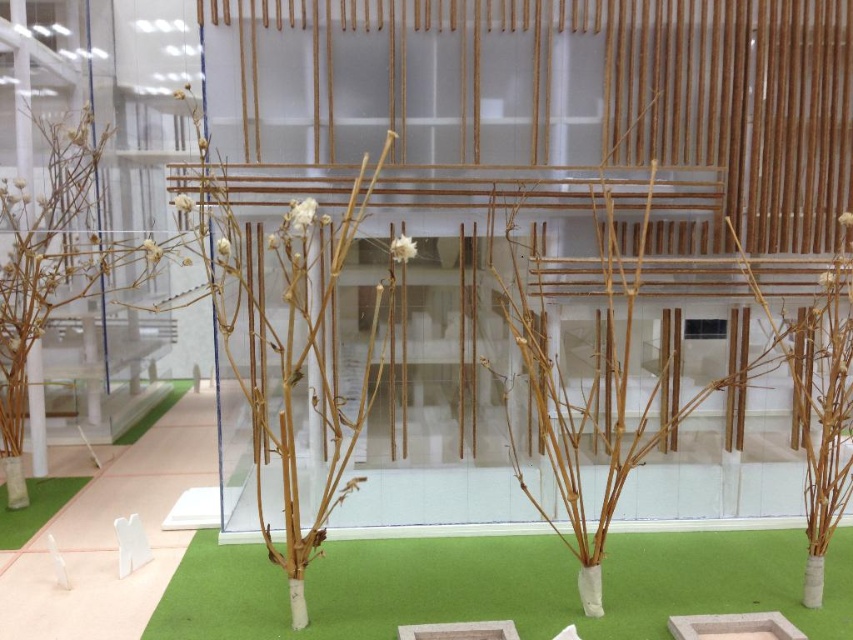
Does point (15, 516) come farther from viewer compared to point (140, 422)?

No, (15, 516) is in front of (140, 422).

Based on the photo, is green artificial grass at lower left shorter than green artificial grass at center?

Correct, green artificial grass at lower left is not as tall as green artificial grass at center.

Locate an element on the screen. This screenshot has width=853, height=640. green artificial grass at lower left is located at coordinates (33, 508).

Where is `green artificial grass at lower left`? green artificial grass at lower left is located at coordinates (33, 508).

Does brown matte branches at left have a smaller size compared to green artificial grass at center?

Actually, brown matte branches at left might be larger than green artificial grass at center.

Which is more to the right, brown matte branches at left or green artificial grass at center?

brown matte branches at left

Is point (62, 147) positioned before point (190, 380)?

Yes, point (62, 147) is closer to viewer.

Find the location of `brown matte branches at left`. brown matte branches at left is located at coordinates (51, 268).

Who is positioned more to the right, brown matte branches at left or green artificial grass at lower left?

brown matte branches at left is more to the right.

Can you confirm if brown matte branches at left is thinner than green artificial grass at lower left?

In fact, brown matte branches at left might be wider than green artificial grass at lower left.

Is point (3, 269) farther from viewer compared to point (68, 499)?

No, it is not.

Where is `brown matte branches at left`? The height and width of the screenshot is (640, 853). brown matte branches at left is located at coordinates (51, 268).